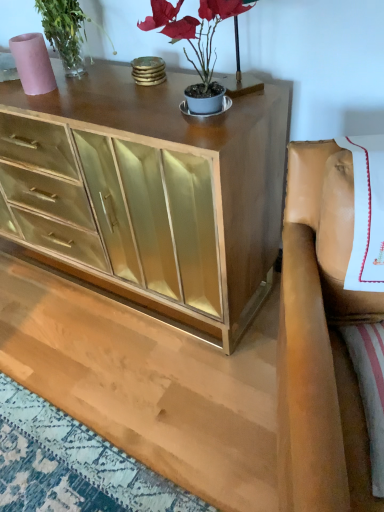
Question: From the image's perspective, is leather at right positioned above or below gold mirrored cabinet at center?

Choices:
 (A) below
 (B) above

Answer: (A)

Question: Considering the positions of leather at right and gold mirrored cabinet at center in the image, is leather at right wider or thinner than gold mirrored cabinet at center?

Choices:
 (A) wide
 (B) thin

Answer: (A)

Question: Which object is positioned closest to the matte pink vase at upper left?

Choices:
 (A) matte gold plant at upper center
 (B) gold mirrored cabinet at center
 (C) leather at right

Answer: (B)

Question: Estimate the real-world distances between objects in this image. Which object is closer to the leather at right?

Choices:
 (A) gold mirrored cabinet at center
 (B) matte gold plant at upper center
 (C) matte pink vase at upper left

Answer: (B)